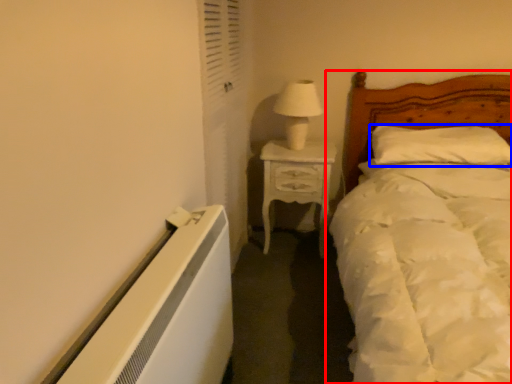
Question: Among these objects, which one is nearest to the camera, bed (highlighted by a red box) or pillow (highlighted by a blue box)?

Choices:
 (A) bed
 (B) pillow

Answer: (A)